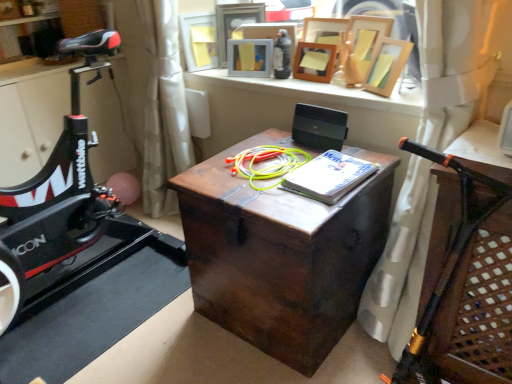
Question: Which is correct: wooden picture frame at upper center, the 5th picture frame when ordered from left to right, is inside wooden picture frame at upper center, which appears as the sixth picture frame when viewed from the left, or outside of it?

Choices:
 (A) outside
 (B) inside

Answer: (A)

Question: In terms of width, does wooden picture frame at upper center, which appears as the 2th picture frame when viewed from the right, look wider or thinner when compared to wooden picture frame at upper center, which appears as the sixth picture frame when viewed from the left?

Choices:
 (A) thin
 (B) wide

Answer: (B)

Question: Considering the real-world distances, which object is closest to the wooden table at right?

Choices:
 (A) dark wood trunk at center
 (B) wooden picture frame at upper center, which appears as the sixth picture frame when viewed from the left
 (C) wooden picture frame at upper center, marked as the 3th picture frame in a right-to-left arrangement
 (D) wooden picture frame at upper center, placed as the 6th picture frame when sorted from right to left
 (E) wooden picture frame at upper center, which is counted as the 5th picture frame, starting from the right

Answer: (A)

Question: Which object is positioned farthest from the wooden picture frame at upper center, which appears as the 2th picture frame when viewed from the right?

Choices:
 (A) wooden picture frame at upper center, which appears as the sixth picture frame when viewed from the left
 (B) dark wood trunk at center
 (C) wooden table at right
 (D) wooden picture frame at upper center, marked as the 3th picture frame in a right-to-left arrangement
 (E) matte plastic picture frame at upper center, the 3th picture frame from the left

Answer: (C)